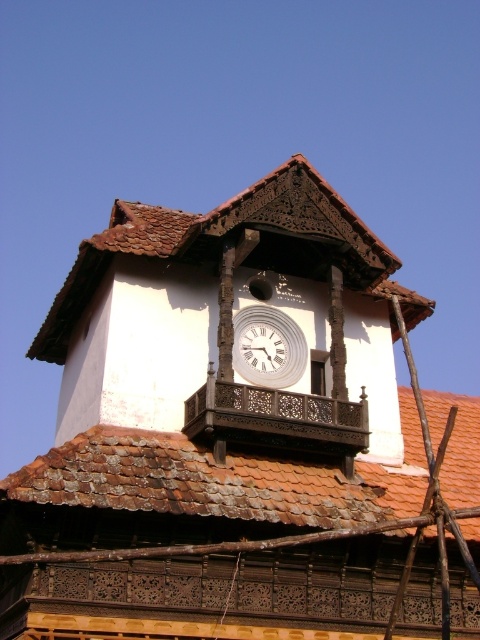
You are a maintenance worker needing to reach both the brown tiled roof at upper center and the white wooden clock at center. The ladder you have can only extend to 5 meters. Can you safely reach both objects with this ladder?

The brown tiled roof at upper center and the white wooden clock at center are 5.16 meters apart. Since the ladder can only extend to 5 meters, it is not long enough to safely reach both objects.

You are a maintenance worker needing to inspect both the brown tiled roof at upper center and the white glossy clock at center. Given that your ladder can reach up to 5 meters, can you safely access both objects with the same ladder placement?

The brown tiled roof at upper center and white glossy clock at center are 4.83 meters apart. Since the ladder can reach up to 5 meters, you can safely access both objects with the same ladder placement as the distance between them is within the ladder reach.